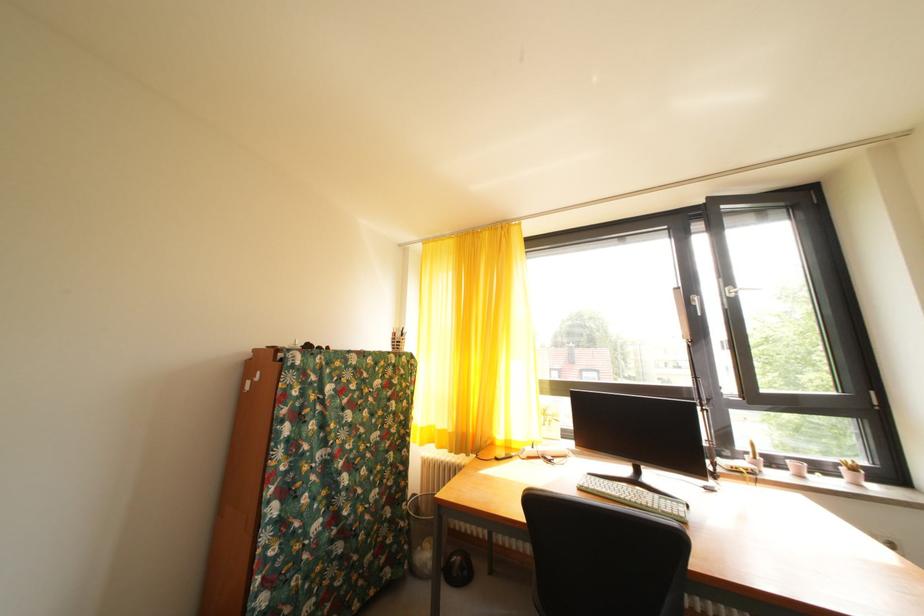
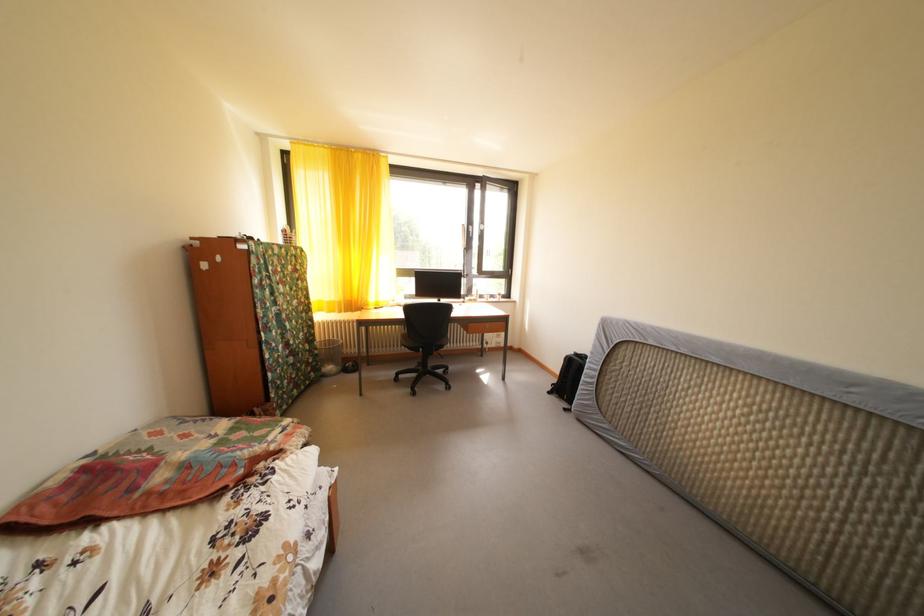
Find the pixel in the second image that matches point 399,527 in the first image.

(320, 357)